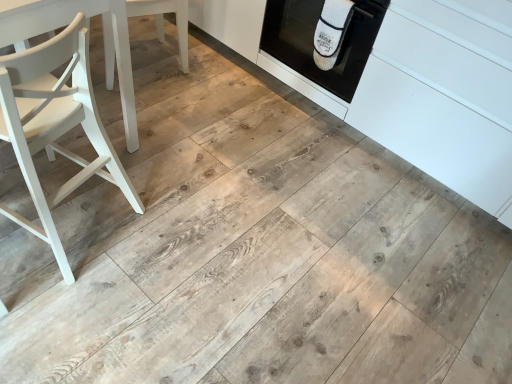
Question: From the image's perspective, would you say white matte wood chair at left, which is the 2th chair from bottom to top, is positioned over white matte cabinetry at center?

Choices:
 (A) yes
 (B) no

Answer: (B)

Question: Is white matte wood chair at left, placed as the first chair when sorted from top to bottom, not near white matte cabinetry at center?

Choices:
 (A) no
 (B) yes

Answer: (B)

Question: Does white matte wood chair at left, which is the 1th chair from back to front, have a lesser height compared to white matte cabinetry at center?

Choices:
 (A) no
 (B) yes

Answer: (B)

Question: Considering the relative sizes of white matte wood chair at left, the 2th chair positioned from the front, and white matte cabinetry at center in the image provided, is white matte wood chair at left, the 2th chair positioned from the front, wider than white matte cabinetry at center?

Choices:
 (A) no
 (B) yes

Answer: (A)

Question: From the image's perspective, is white matte wood chair at left, the 2th chair positioned from the front, below white matte cabinetry at center?

Choices:
 (A) yes
 (B) no

Answer: (A)

Question: Is white painted wood chair at left, the 2th chair viewed from the back, situated inside white ribbed oven mitt at upper right or outside?

Choices:
 (A) inside
 (B) outside

Answer: (B)

Question: In terms of size, does white painted wood chair at left, which ranks as the 2th chair in top-to-bottom order, appear bigger or smaller than white ribbed oven mitt at upper right?

Choices:
 (A) small
 (B) big

Answer: (A)

Question: Relative to white ribbed oven mitt at upper right, is white painted wood chair at left, the 2th chair viewed from the back, in front or behind?

Choices:
 (A) front
 (B) behind

Answer: (A)

Question: Does point (37, 145) appear closer or farther from the camera than point (364, 0)?

Choices:
 (A) farther
 (B) closer

Answer: (B)

Question: From the image's perspective, is white painted wood chair at left, which ranks as the 2th chair in top-to-bottom order, located above or below white matte cabinetry at center?

Choices:
 (A) above
 (B) below

Answer: (B)

Question: In the image, is white painted wood chair at left, the 2th chair viewed from the back, positioned in front of or behind white matte cabinetry at center?

Choices:
 (A) front
 (B) behind

Answer: (A)

Question: From a real-world perspective, is white painted wood chair at left, which is counted as the 1th chair, starting from the bottom, physically located above or below white matte cabinetry at center?

Choices:
 (A) below
 (B) above

Answer: (A)

Question: Based on their sizes in the image, would you say white painted wood chair at left, which ranks as the 2th chair in top-to-bottom order, is bigger or smaller than white matte cabinetry at center?

Choices:
 (A) small
 (B) big

Answer: (A)

Question: Which is correct: white ribbed oven mitt at upper right is inside white matte cabinetry at center, or outside of it?

Choices:
 (A) outside
 (B) inside

Answer: (B)

Question: In terms of width, does white ribbed oven mitt at upper right look wider or thinner when compared to white matte cabinetry at center?

Choices:
 (A) thin
 (B) wide

Answer: (A)